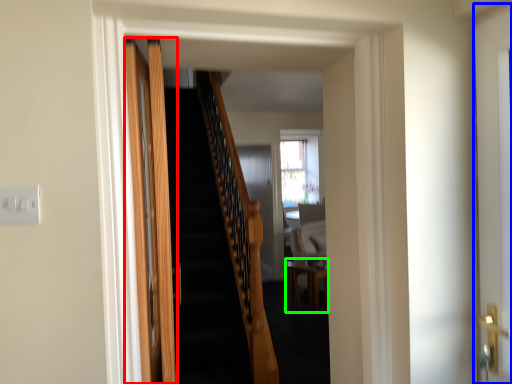
Question: Which object is the closest to the door (highlighted by a red box)? Choose among these: door (highlighted by a blue box) or table (highlighted by a green box).

Choices:
 (A) door
 (B) table

Answer: (A)